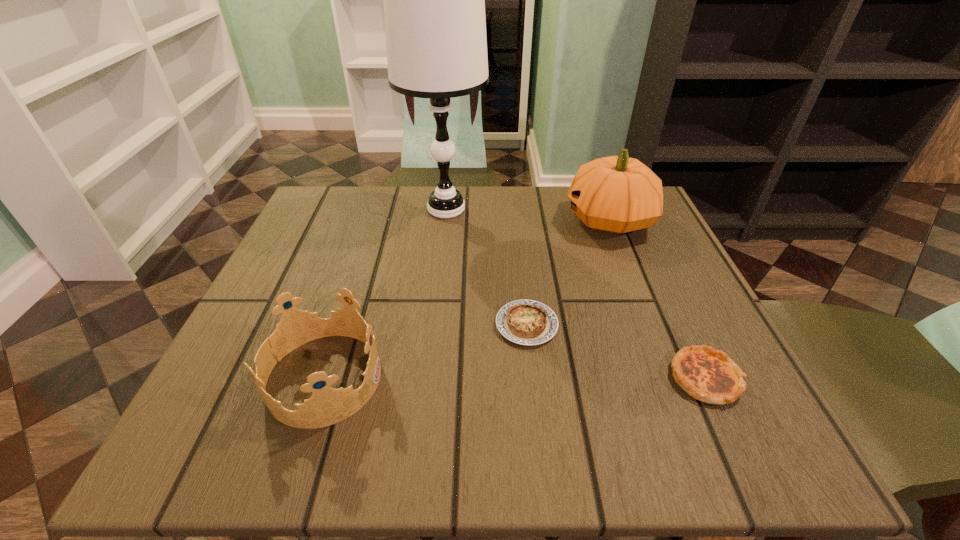
At what (x,y) coordinates should I click in order to perform the action: click on object present at the near left corner. Please return your answer as a coordinate pair (x, y). The width and height of the screenshot is (960, 540). Looking at the image, I should click on (327, 406).

You are a GUI agent. You are given a task and a screenshot of the screen. Output one action in this format:
    pyautogui.click(x=<x>, y=<y>)
    Task: Click on the object present at the far right corner
    The height and width of the screenshot is (540, 960).
    Given the screenshot: What is the action you would take?
    pyautogui.click(x=617, y=194)

At what (x,y) coordinates should I click in order to perform the action: click on object present at the near right corner. Please return your answer as a coordinate pair (x, y). The height and width of the screenshot is (540, 960). Looking at the image, I should click on (708, 375).

At what (x,y) coordinates should I click in order to perform the action: click on vacant region at the far edge of the desktop. Please return your answer as a coordinate pair (x, y). Looking at the image, I should click on (492, 238).

Where is `free region at the near edge of the desktop`? free region at the near edge of the desktop is located at coordinates (581, 412).

In the image, there is a desktop. In order to click on free space at the left edge in this screenshot , I will do `click(306, 260)`.

Locate an element on the screen. vacant point at the right edge is located at coordinates (640, 253).

In the image, there is a desktop. Identify the location of free space at the far left corner. Image resolution: width=960 pixels, height=540 pixels. (323, 221).

The height and width of the screenshot is (540, 960). I want to click on free space between the third shortest object and the table lamp, so click(x=385, y=293).

Locate an element on the screen. The image size is (960, 540). vacant space in between the left quiche and the tallest object is located at coordinates (487, 267).